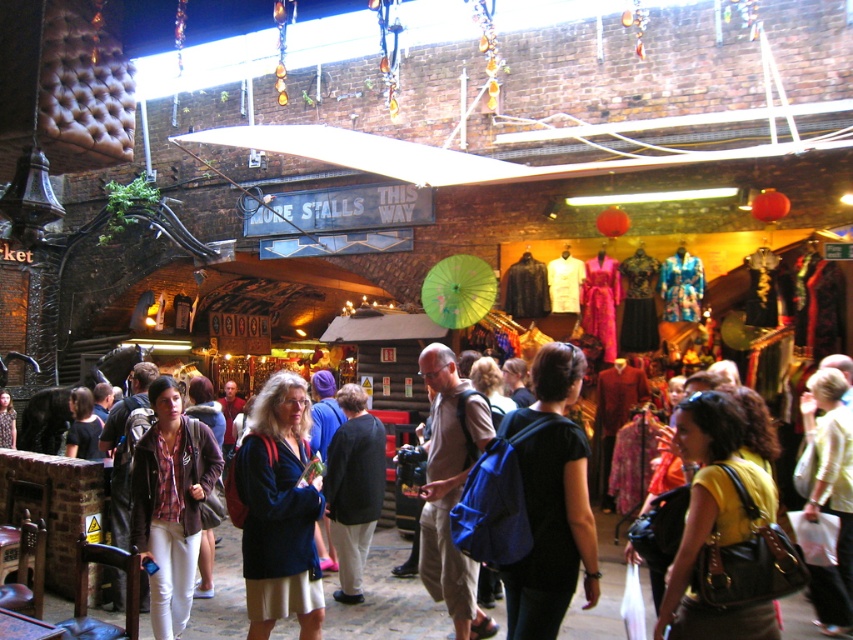
Question: Which is farther from the black fabric backpack at center?

Choices:
 (A) matte black jacket at center
 (B) plaid fabric shirt at center

Answer: (A)

Question: From the image, what is the correct spatial relationship of plaid fabric shirt at center in relation to dark blue jacket at center?

Choices:
 (A) left
 (B) right

Answer: (A)

Question: Which object is positioned closest to the yellow matte shirt at center?

Choices:
 (A) matte black jacket at center
 (B) plaid fabric shirt at center
 (C) dark blue jacket at center
 (D) yellow fabric bag at center

Answer: (D)

Question: Is plaid fabric shirt at center to the right of yellow fabric bag at center from the viewer's perspective?

Choices:
 (A) no
 (B) yes

Answer: (A)

Question: Which object is closer to the camera taking this photo?

Choices:
 (A) dark blue jacket at center
 (B) dark blue sweater at center
 (C) matte black jacket at center

Answer: (B)

Question: Can you confirm if yellow matte shirt at center is thinner than matte black jacket at center?

Choices:
 (A) no
 (B) yes

Answer: (B)